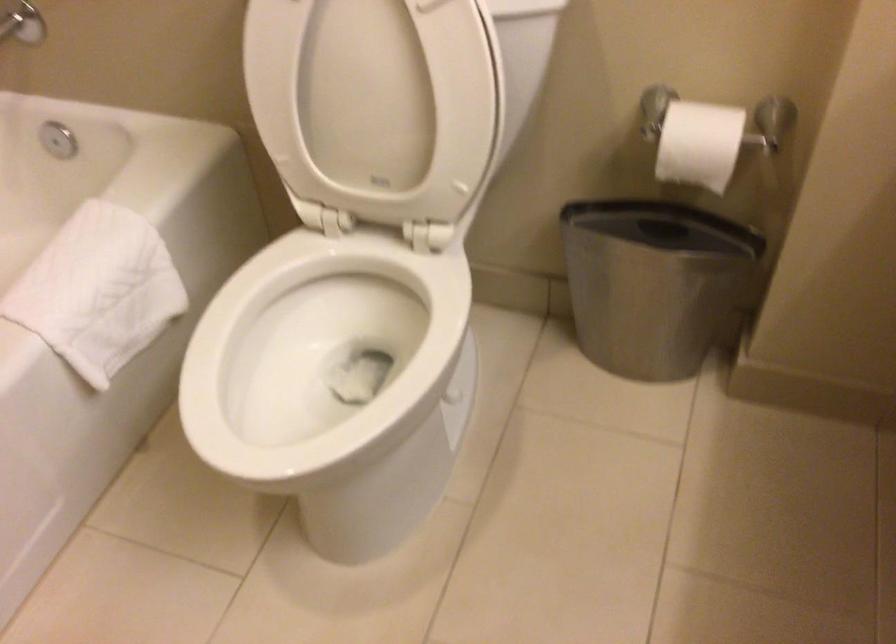
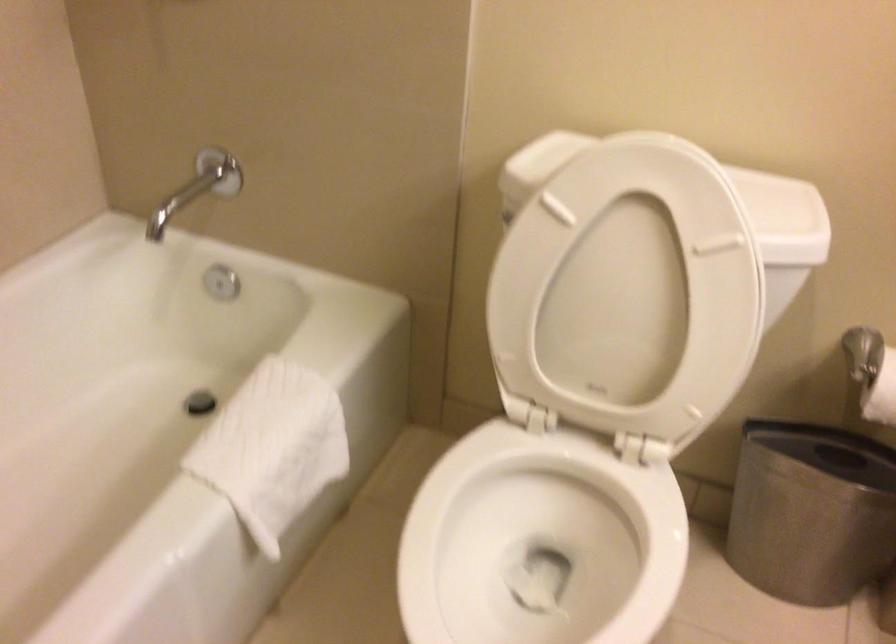
In the second image, find the point that corresponds to (87,285) in the first image.

(272, 448)